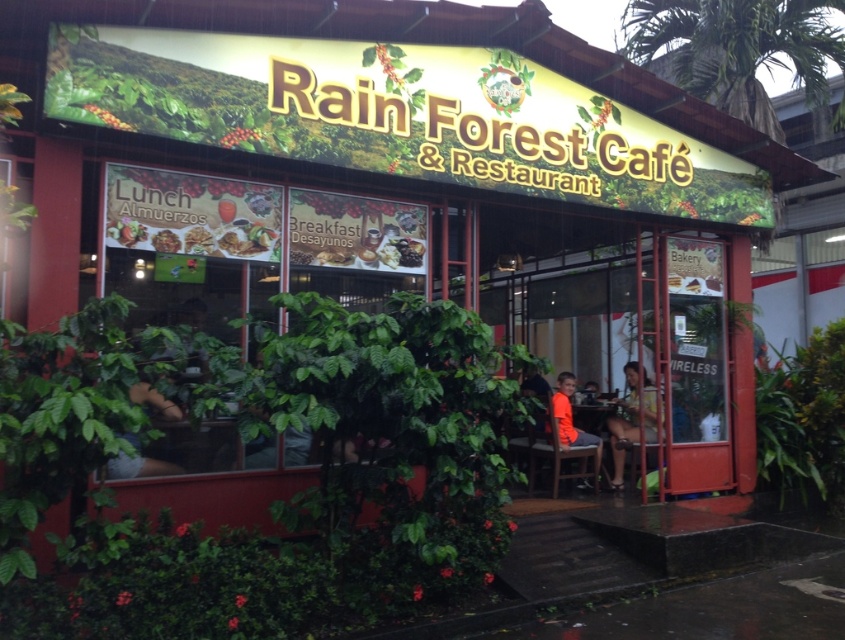
Which is behind, point (614, 424) or point (177, 246)?

Positioned behind is point (614, 424).

Which is below, yellow floral shirt at center or matte brown bread at center?

yellow floral shirt at center

Is point (619, 474) closer to camera compared to point (162, 230)?

No, (619, 474) is behind (162, 230).

The height and width of the screenshot is (640, 845). I want to click on yellow floral shirt at center, so click(631, 417).

Does wooden table at center appear under smooth white plate at center?

Yes, wooden table at center is below smooth white plate at center.

Who is positioned more to the left, wooden table at center or smooth white plate at center?

From the viewer's perspective, smooth white plate at center appears more on the left side.

Is point (598, 397) farther from camera compared to point (341, 266)?

Yes, it is behind point (341, 266).

Image resolution: width=845 pixels, height=640 pixels. I want to click on wooden table at center, so click(593, 412).

Does blue denim jeans at lower left appear over wooden table at center?

Yes, blue denim jeans at lower left is above wooden table at center.

Who is shorter, blue denim jeans at lower left or wooden table at center?

Standing shorter between the two is blue denim jeans at lower left.

Who is more forward, (146, 381) or (604, 403)?

Point (146, 381)

Locate an element on the screen. The image size is (845, 640). blue denim jeans at lower left is located at coordinates (138, 467).